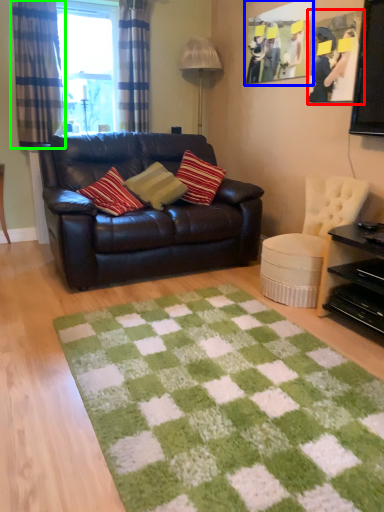
Question: Which is nearer to the picture frame (highlighted by a red box)? picture frame (highlighted by a blue box) or curtain (highlighted by a green box).

Choices:
 (A) picture frame
 (B) curtain

Answer: (A)